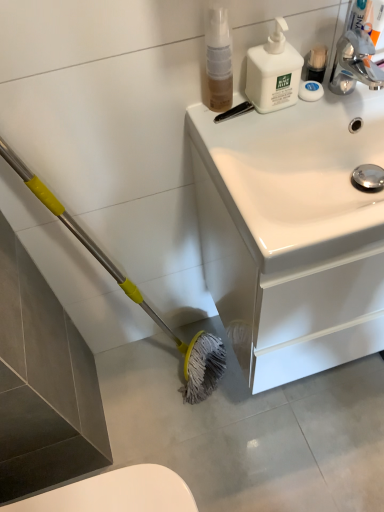
You are a GUI agent. You are given a task and a screenshot of the screen. Output one action in this format:
    pyautogui.click(x=<x>, y=<y>)
    Task: Click on the vacant area in front of translucent plastic spray bottle at upper center, placed as the 2th cleaning product when sorted from right to left
    
    Given the screenshot: What is the action you would take?
    pyautogui.click(x=235, y=136)